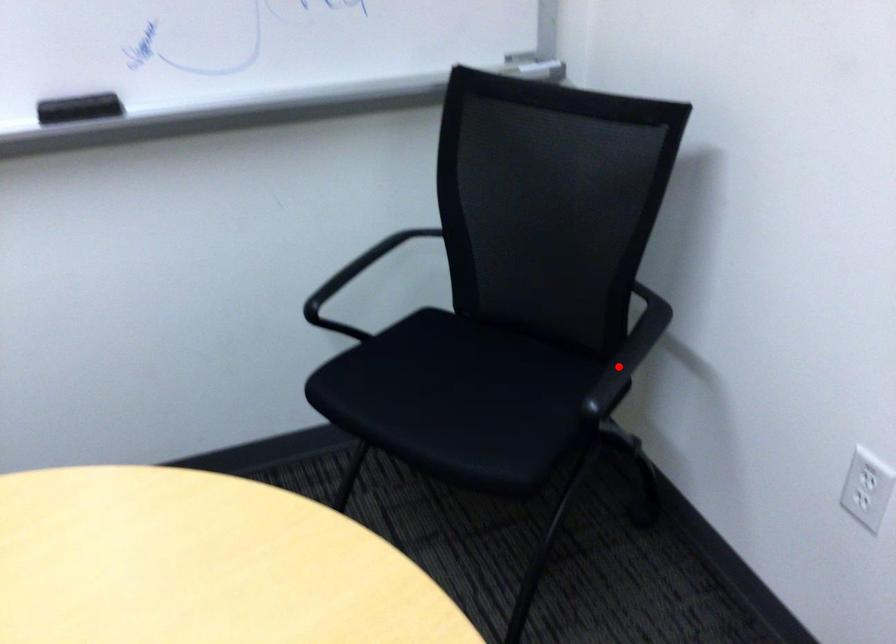
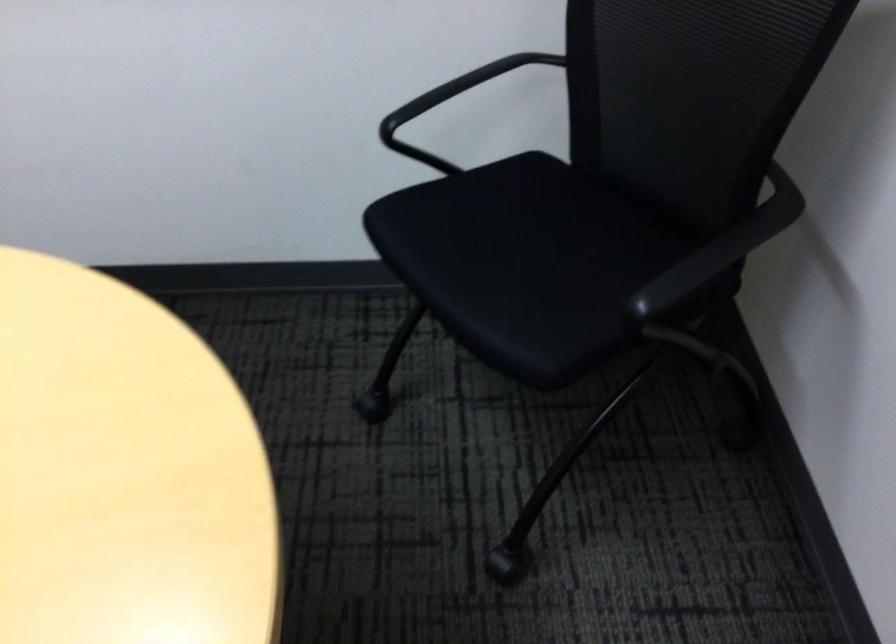
Question: I am providing you with two images of the same scene from different viewpoints. In image1, a red point is highlighted. Considering the same 3D point in image2, which of the following is correct?

Choices:
 (A) It is closer
 (B) It is farther

Answer: (A)